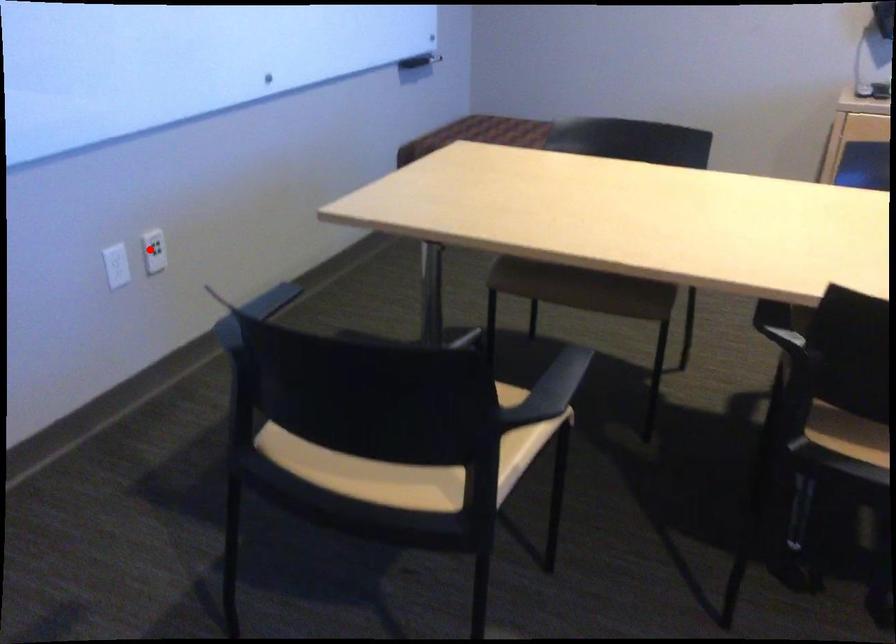
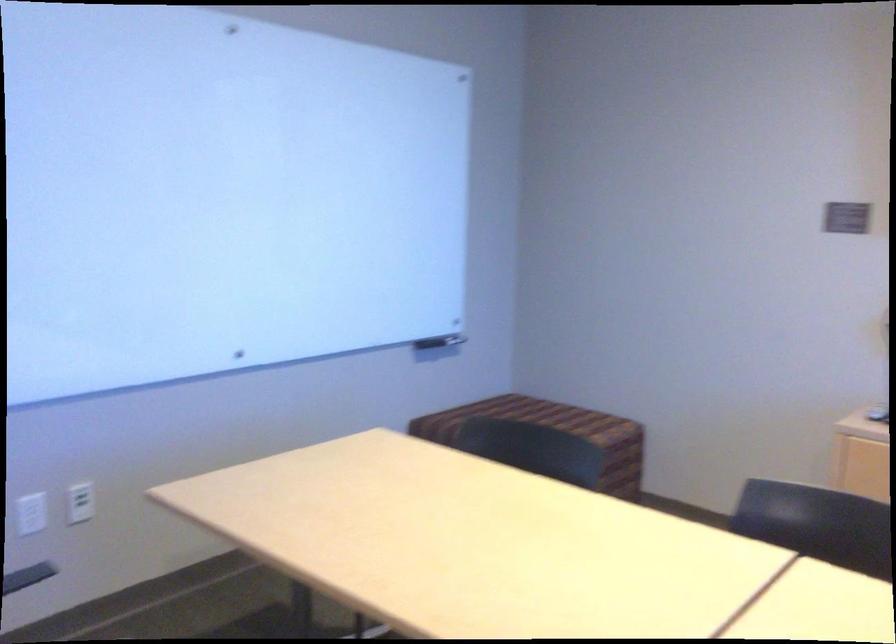
Question: I am providing you with two images of the same scene from different viewpoints. Given a red point in image1, look at the same physical point in image2. Is it:

Choices:
 (A) Closer to the viewpoint
 (B) Farther from the viewpoint

Answer: (B)